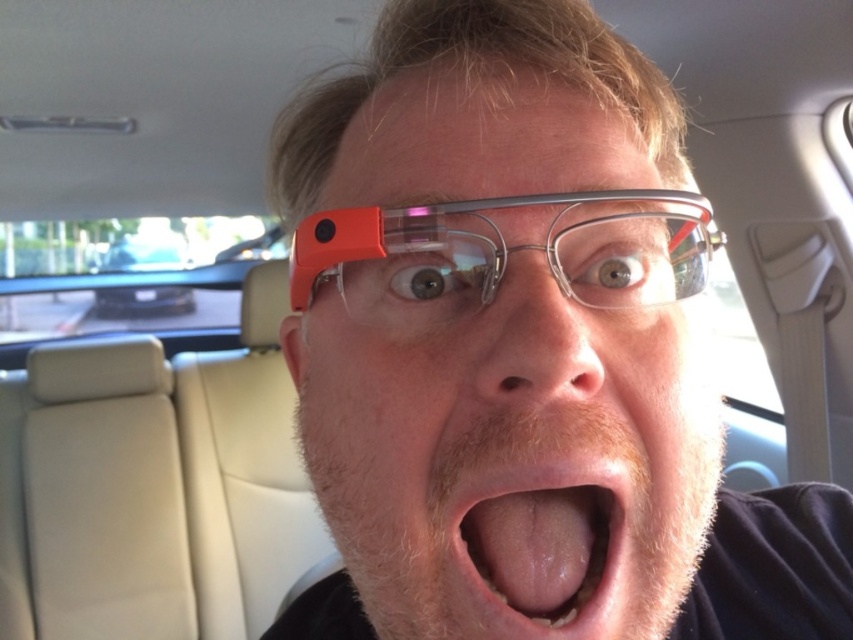
Question: Which point is farther to the camera?

Choices:
 (A) (181, 308)
 (B) (520, 474)

Answer: (A)

Question: Does orange plastic google glass at center have a lesser width compared to metallic silver car at upper left?

Choices:
 (A) no
 (B) yes

Answer: (B)

Question: Which object is the closest to the orange plastic google glass at center?

Choices:
 (A) pink flesh at center
 (B) matte orange glasses at center

Answer: (B)

Question: Which object appears closest to the camera in this image?

Choices:
 (A) pink flesh at center
 (B) metallic silver car at upper left
 (C) matte orange glasses at center
 (D) orange plastic google glass at center

Answer: (C)

Question: Can you confirm if pink flesh at center is thinner than metallic silver car at upper left?

Choices:
 (A) yes
 (B) no

Answer: (A)

Question: Does pink flesh at center appear over metallic silver car at upper left?

Choices:
 (A) yes
 (B) no

Answer: (B)